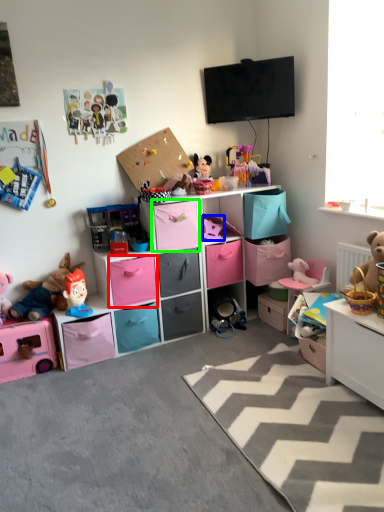
Question: Considering the real-world distances, which object is farthest from drawer (highlighted by a red box)? toy (highlighted by a blue box) or cabinet (highlighted by a green box)?

Choices:
 (A) toy
 (B) cabinet

Answer: (A)